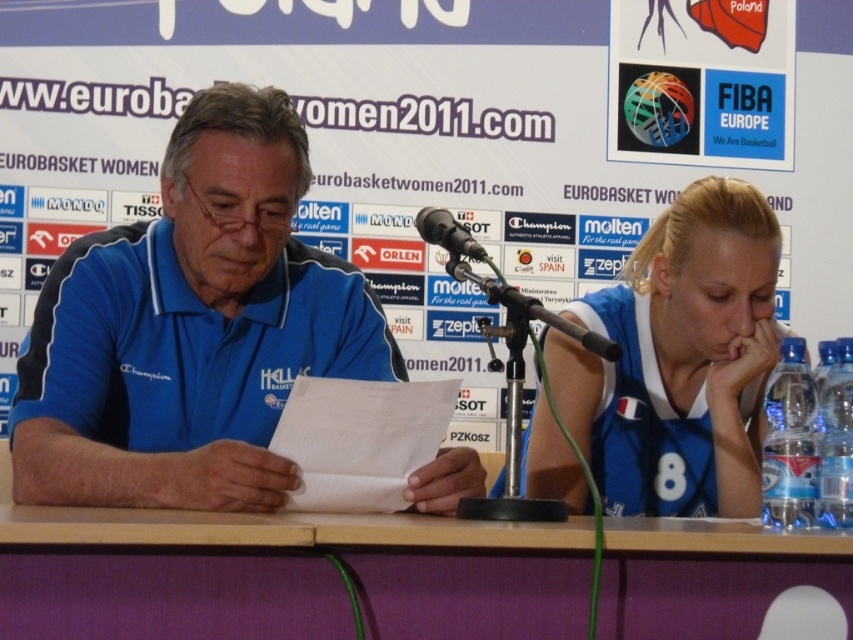
You are a photographer at the EuroBasket Women 2011 press conference. You need to take a closeup photo of the blue jersey at right. Where should you aim your camera?

The blue jersey at right is located at the 2D coordinates point (x=679, y=358), so aim your camera there.

You are a photographer at the event and need to capture a closeup shot of the blue jersey at center and the black plastic microphone at center. Given that your camera has a minimum focus distance of 18 inches, will you be able to take the photo without moving either object?

The blue jersey at center is 18.52 inches from the black plastic microphone at center. Since the distance is slightly over the camera minimum focus distance of 18 inches, you can take the photo without moving either object.

You are a photographer at the EuroBasket Women 2011 press conference. You need to ensure that both the blue jersey at center and the wooden table at center are visible in your shot. Based on their sizes, which object should you focus on first to frame the shot properly?

The blue jersey at center is much taller than the wooden table at center, so you should focus on framing the blue jersey at center first to ensure it fits properly in the shot.